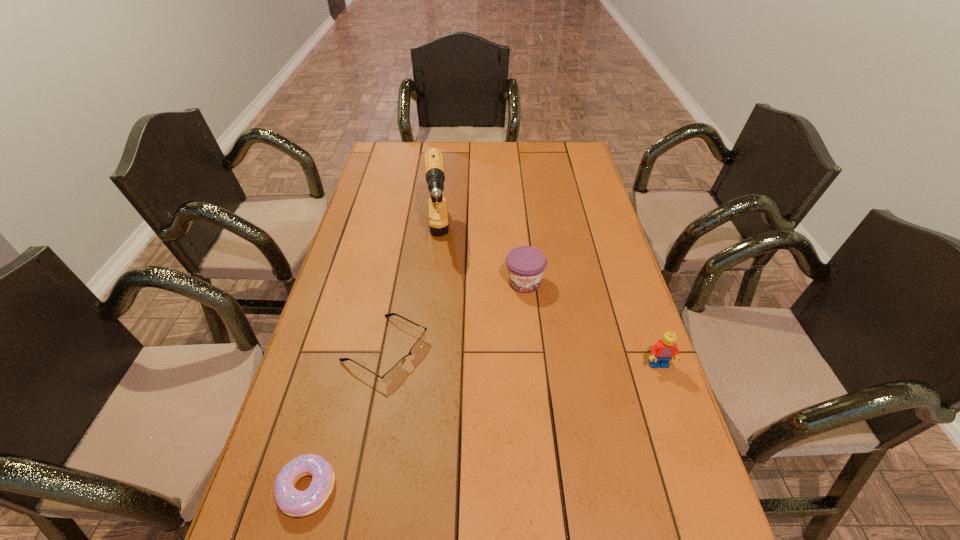
This screenshot has width=960, height=540. I want to click on spectacles that is at the left edge, so click(394, 371).

This screenshot has height=540, width=960. Identify the location of object that is positioned at the right edge. (663, 351).

The width and height of the screenshot is (960, 540). What are the coordinates of `object that is at the near left corner` in the screenshot? It's located at (292, 502).

In the image, there is a desktop. Identify the location of vacant area at the far edge. (411, 170).

At what (x,y) coordinates should I click in order to perform the action: click on vacant space at the near edge of the desktop. Please return your answer as a coordinate pair (x, y). The width and height of the screenshot is (960, 540). Looking at the image, I should click on (612, 508).

The height and width of the screenshot is (540, 960). I want to click on vacant area at the left edge of the desktop, so click(384, 264).

You are a GUI agent. You are given a task and a screenshot of the screen. Output one action in this format:
    pyautogui.click(x=<x>, y=<y>)
    Task: Click on the vacant space at the right edge of the desktop
    This screenshot has width=960, height=540.
    Given the screenshot: What is the action you would take?
    pyautogui.click(x=624, y=389)

The image size is (960, 540). In the image, there is a desktop. What are the coordinates of `vacant space at the far left corner` in the screenshot? It's located at (391, 149).

Where is `free point at the far right corner`? This screenshot has height=540, width=960. free point at the far right corner is located at coordinates (583, 161).

Identify the location of free space that is in between the third shortest object and the spectacles. (454, 316).